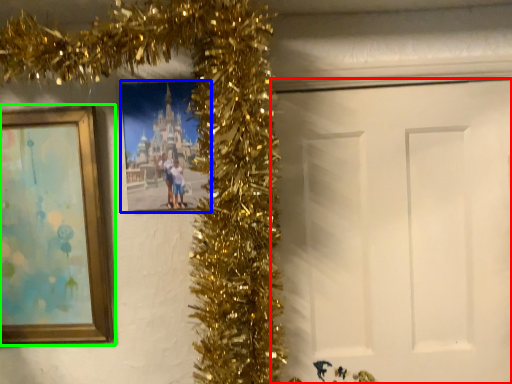
Question: Estimate the real-world distances between objects in this image. Which object is closer to door (highlighted by a red box), picture frame (highlighted by a blue box) or picture frame (highlighted by a green box)?

Choices:
 (A) picture frame
 (B) picture frame

Answer: (A)